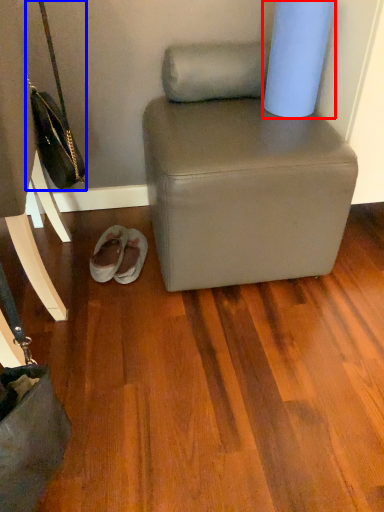
Question: Which object appears closest to the camera in this image, toilet paper (highlighted by a red box) or handbag (highlighted by a blue box)?

Choices:
 (A) toilet paper
 (B) handbag

Answer: (B)